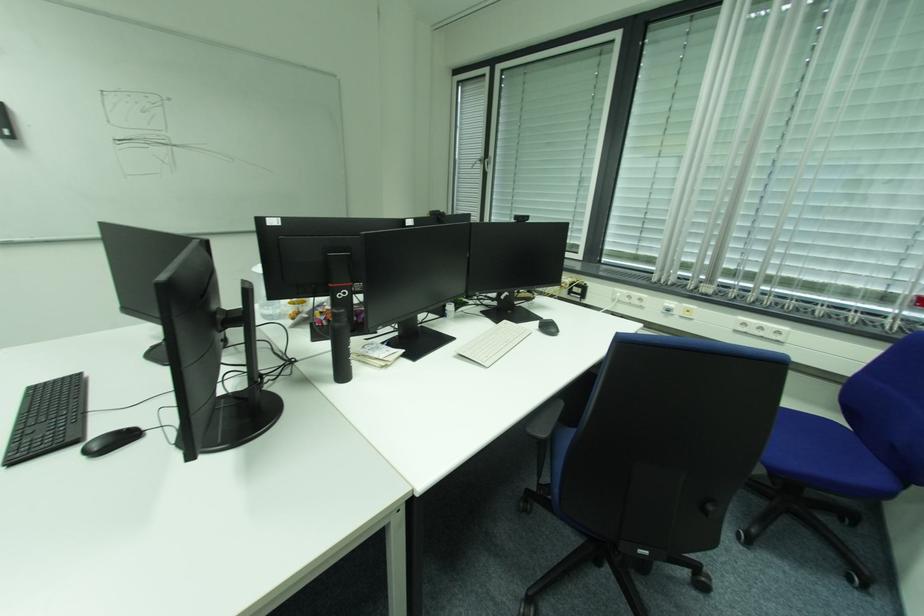
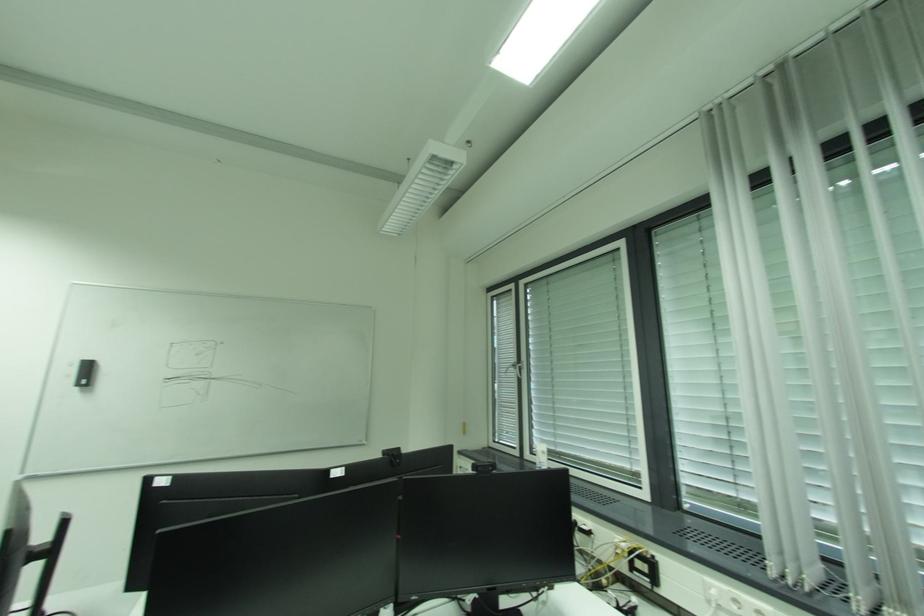
Based on the continuous images, in which direction is the camera rotating?

The camera rotated toward left-up.